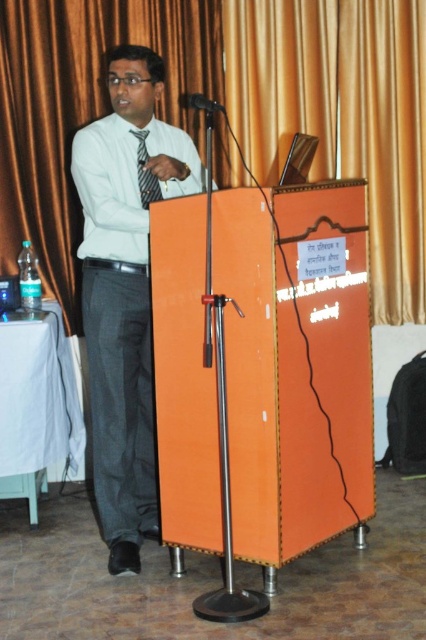
You are an event planner setting up a stage for a presentation. The stage has a gold fabric curtain at upper center. Where exactly should you place the curtain to match the image?

The gold fabric curtain at upper center should be placed at point (83, 109) to match the image.